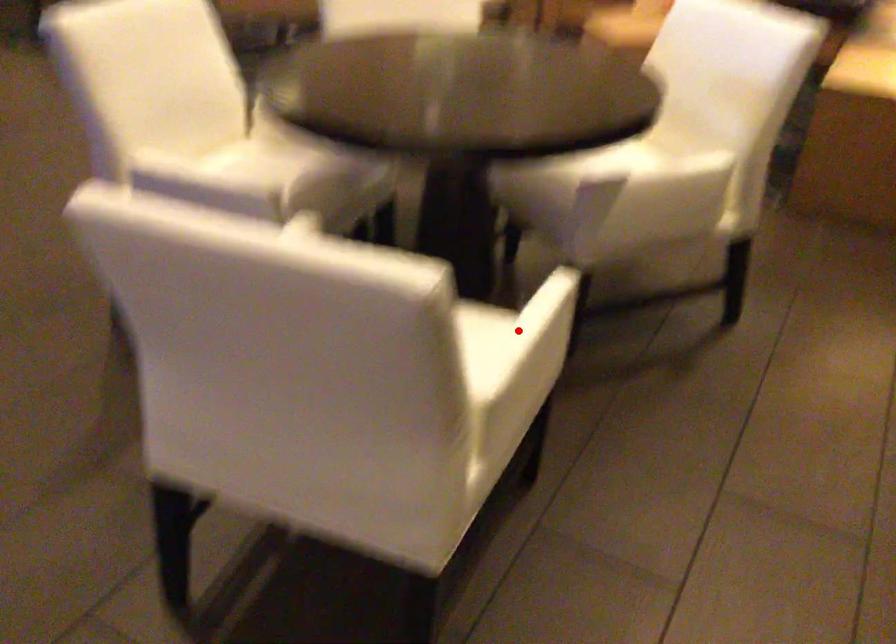
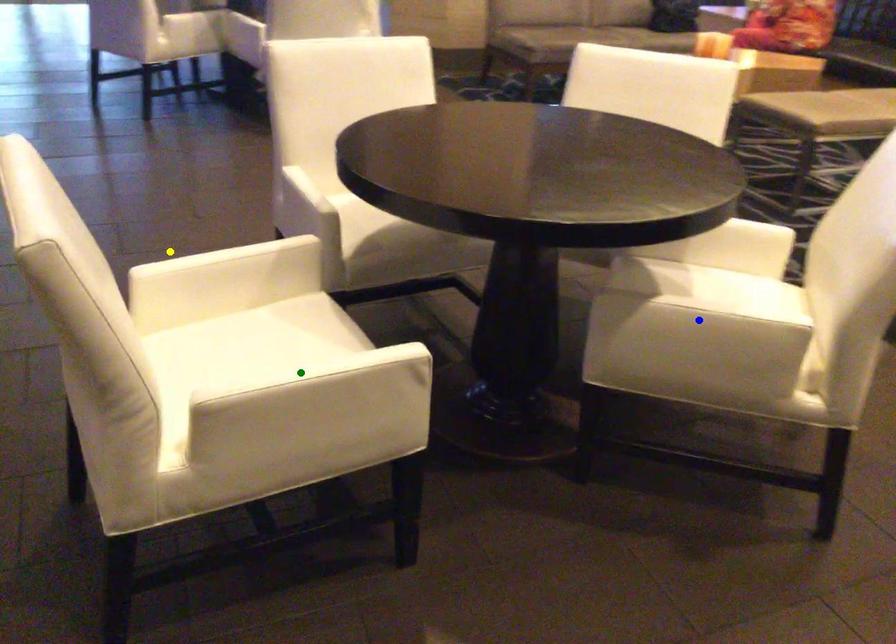
Question: I am providing you with two images of the same scene from different viewpoints. A red point is marked on the first image. You are given multiple points on the second image. Which point in image 2 represents the same 3d spot as the red point in image 1?

Choices:
 (A) green point
 (B) blue point
 (C) yellow point

Answer: (A)